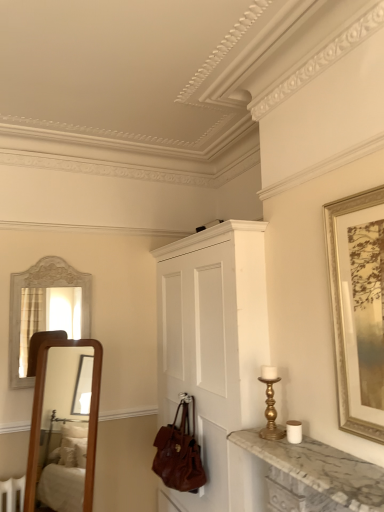
Question: Do you think marble at right is within brown leather handbag at lower center, or outside of it?

Choices:
 (A) outside
 (B) inside

Answer: (A)

Question: Is marble at right taller or shorter than brown leather handbag at lower center?

Choices:
 (A) tall
 (B) short

Answer: (B)

Question: Which is farther from the white painted wood cabinet at center?

Choices:
 (A) brown leather handbag at lower center
 (B) gold-framed artwork at right
 (C) marble at right
 (D) gold metallic candle holder at right

Answer: (B)

Question: Which of these objects is positioned farthest from the white painted wood cabinet at center?

Choices:
 (A) marble at right
 (B) brown leather handbag at lower center
 (C) gold-framed artwork at right
 (D) gold metallic candle holder at right

Answer: (C)